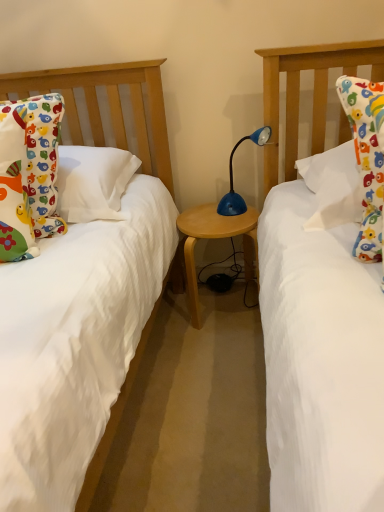
Question: Can you confirm if blue plastic lamp at center is shorter than matte cotton pillow at left?

Choices:
 (A) no
 (B) yes

Answer: (B)

Question: Is matte cotton pillow at left at the back of blue plastic lamp at center?

Choices:
 (A) yes
 (B) no

Answer: (B)

Question: Is blue plastic lamp at center positioned behind matte cotton pillow at left?

Choices:
 (A) no
 (B) yes

Answer: (B)

Question: Can we say blue plastic lamp at center lies outside matte cotton pillow at left?

Choices:
 (A) yes
 (B) no

Answer: (A)

Question: Is matte cotton pillow at left a part of blue plastic lamp at center?

Choices:
 (A) yes
 (B) no

Answer: (B)

Question: Are blue plastic lamp at center and matte cotton pillow at left beside each other?

Choices:
 (A) no
 (B) yes

Answer: (A)

Question: Is blue plastic lamp at center thinner than wooden table at center?

Choices:
 (A) no
 (B) yes

Answer: (B)

Question: Does blue plastic lamp at center turn towards wooden table at center?

Choices:
 (A) yes
 (B) no

Answer: (B)

Question: Considering the relative sizes of blue plastic lamp at center and wooden table at center in the image provided, is blue plastic lamp at center bigger than wooden table at center?

Choices:
 (A) yes
 (B) no

Answer: (B)

Question: Does blue plastic lamp at center have a greater width compared to wooden table at center?

Choices:
 (A) yes
 (B) no

Answer: (B)

Question: Is blue plastic lamp at center touching wooden table at center?

Choices:
 (A) yes
 (B) no

Answer: (B)

Question: Is blue plastic lamp at center shorter than wooden table at center?

Choices:
 (A) no
 (B) yes

Answer: (B)

Question: From a real-world perspective, is matte cotton pillow at left on wooden table at center?

Choices:
 (A) yes
 (B) no

Answer: (A)